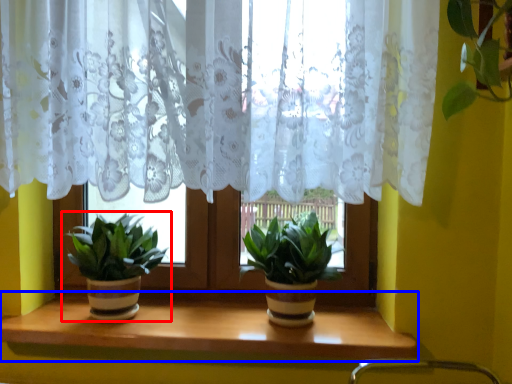
Question: Which of the following is the farthest to the observer, houseplant (highlighted by a red box) or window sill (highlighted by a blue box)?

Choices:
 (A) houseplant
 (B) window sill

Answer: (A)